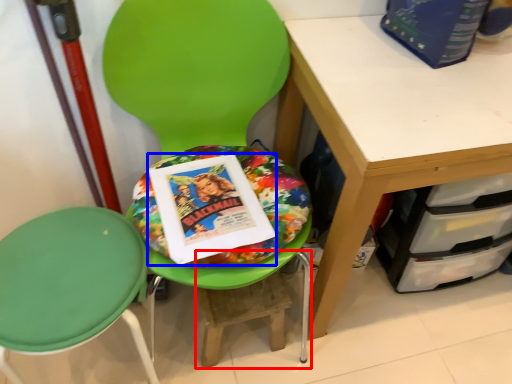
Question: Which point is closer to the camera, step stool (highlighted by a red box) or paperback book (highlighted by a blue box)?

Choices:
 (A) step stool
 (B) paperback book

Answer: (B)